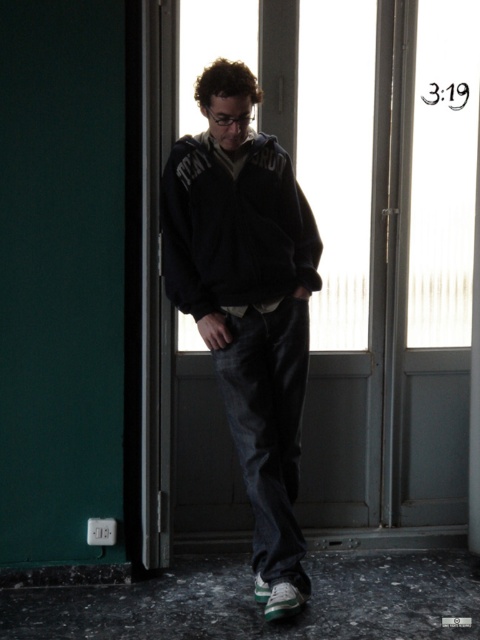
Question: Which of these objects is positioned closest to the transparent glass door at center?

Choices:
 (A) dark blue fleece jacket at center
 (B) dark gray fleece sweatshirt at center

Answer: (A)

Question: Is dark blue fleece jacket at center smaller than dark gray fleece sweatshirt at center?

Choices:
 (A) yes
 (B) no

Answer: (B)

Question: Is transparent glass door at center above dark gray fleece sweatshirt at center?

Choices:
 (A) yes
 (B) no

Answer: (B)

Question: From the image, what is the correct spatial relationship of transparent glass door at center in relation to dark gray fleece sweatshirt at center?

Choices:
 (A) above
 (B) below

Answer: (B)

Question: Which point is closer to the camera?

Choices:
 (A) transparent glass door at center
 (B) dark gray fleece sweatshirt at center

Answer: (B)

Question: Which object is closer to the camera taking this photo?

Choices:
 (A) dark blue fleece jacket at center
 (B) transparent glass door at center
 (C) dark gray fleece sweatshirt at center

Answer: (A)